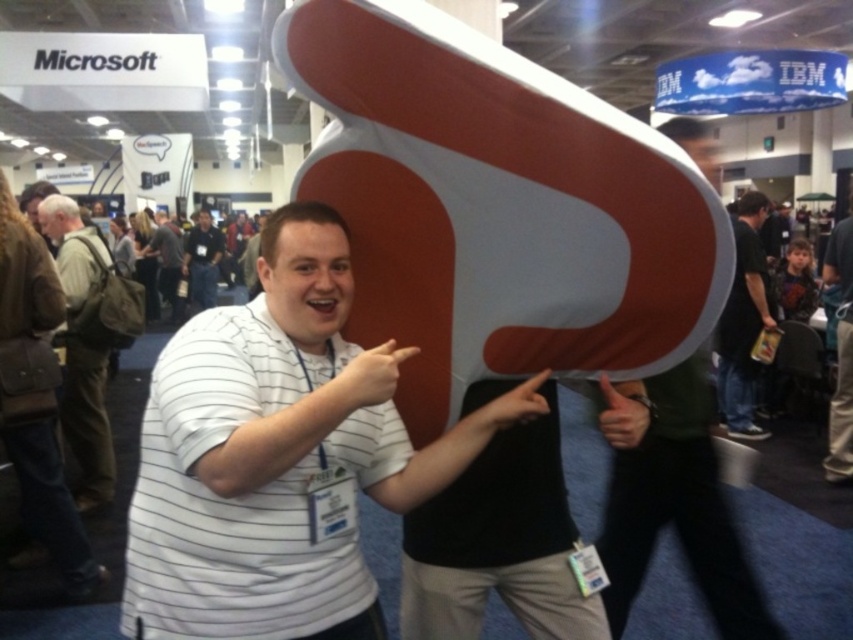
Question: Which of the following is the farthest from the observer?

Choices:
 (A) (341, 429)
 (B) (688, 392)
 (C) (167, 300)

Answer: (C)

Question: Can you confirm if brown fabric pants at lower right is smaller than striped cotton shirt at center?

Choices:
 (A) yes
 (B) no

Answer: (A)

Question: Estimate the real-world distances between objects in this image. Which object is farther from the striped cotton shirt at center?

Choices:
 (A) matte black shirt at center
 (B) brown canvas backpack at left
 (C) brown fabric pants at lower right

Answer: (C)

Question: Which point is closer to the camera?

Choices:
 (A) (287, 445)
 (B) (840, 445)

Answer: (A)

Question: Does matte white sign at center have a lesser width compared to black fabric bag at right?

Choices:
 (A) yes
 (B) no

Answer: (A)

Question: Does brown canvas backpack at left appear over striped cotton shirt at center?

Choices:
 (A) no
 (B) yes

Answer: (A)